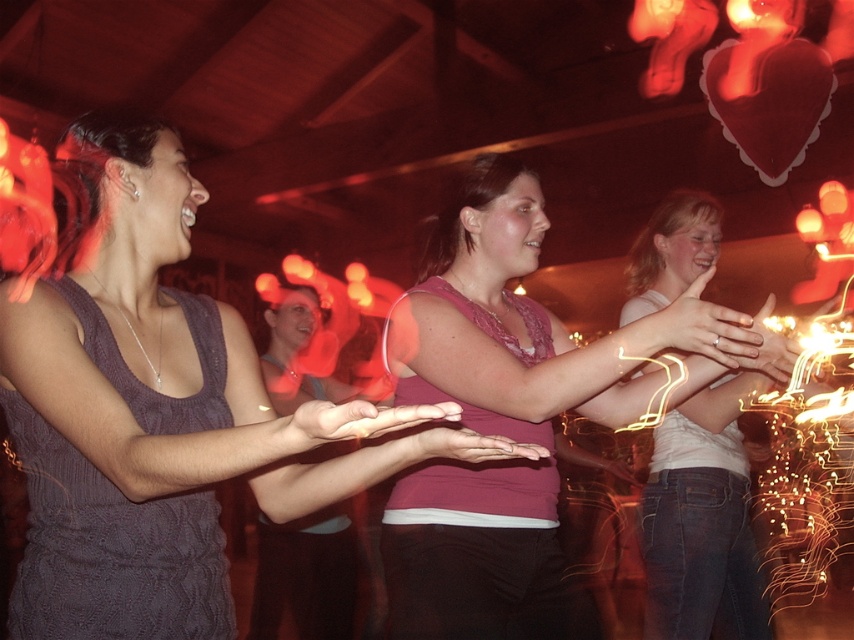
Question: Which point is farther to the camera?

Choices:
 (A) (512, 515)
 (B) (135, 371)
 (C) (670, 516)

Answer: (C)

Question: Can you confirm if matte purple tank top at center is positioned to the left of pink fabric shirt at center?

Choices:
 (A) yes
 (B) no

Answer: (A)

Question: In this image, where is matte purple tank top at center located relative to white matte shirt at center?

Choices:
 (A) below
 (B) above

Answer: (B)

Question: Which object is the farthest from the white matte shirt at center?

Choices:
 (A) matte purple tank top at center
 (B) pink fabric shirt at center

Answer: (A)

Question: Is matte purple tank top at center to the left of pink fabric shirt at center from the viewer's perspective?

Choices:
 (A) yes
 (B) no

Answer: (A)

Question: Which of the following is the farthest from the observer?

Choices:
 (A) (689, 305)
 (B) (162, 497)

Answer: (A)